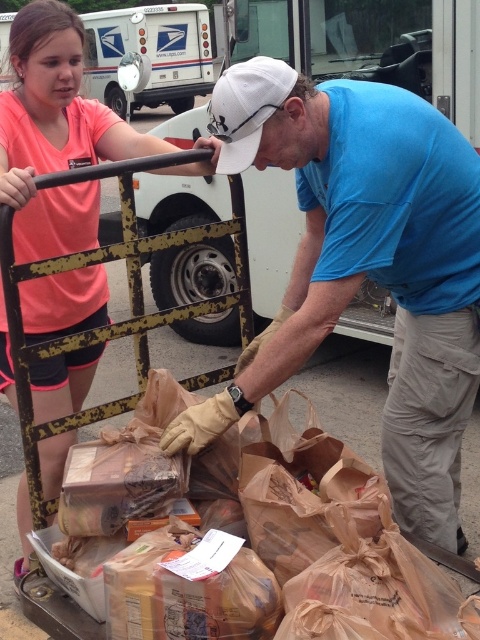
Which is in front, point (372, 236) or point (27, 211)?

Point (372, 236)

Is point (445, 406) farther from viewer compared to point (24, 256)?

No, (445, 406) is in front of (24, 256).

Locate an element on the screen. This screenshot has height=640, width=480. blue t-shirt at center is located at coordinates (364, 266).